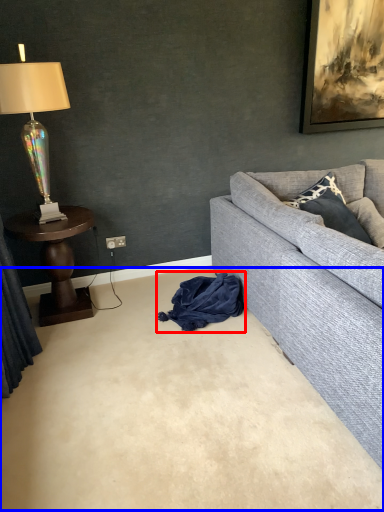
Question: Which object appears farthest to the camera in this image, material (highlighted by a red box) or plain (highlighted by a blue box)?

Choices:
 (A) material
 (B) plain

Answer: (A)